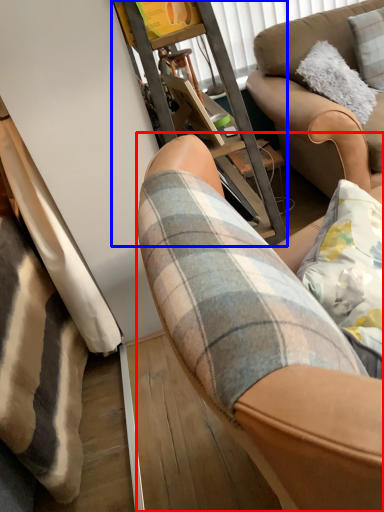
Question: Which object appears closest to the camera in this image, chair (highlighted by a red box) or furniture (highlighted by a blue box)?

Choices:
 (A) chair
 (B) furniture

Answer: (A)